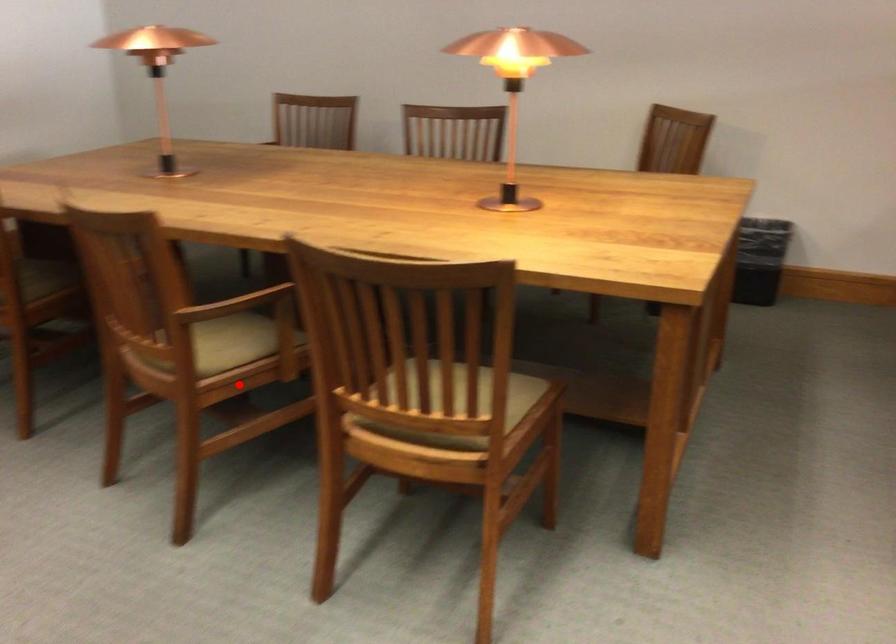
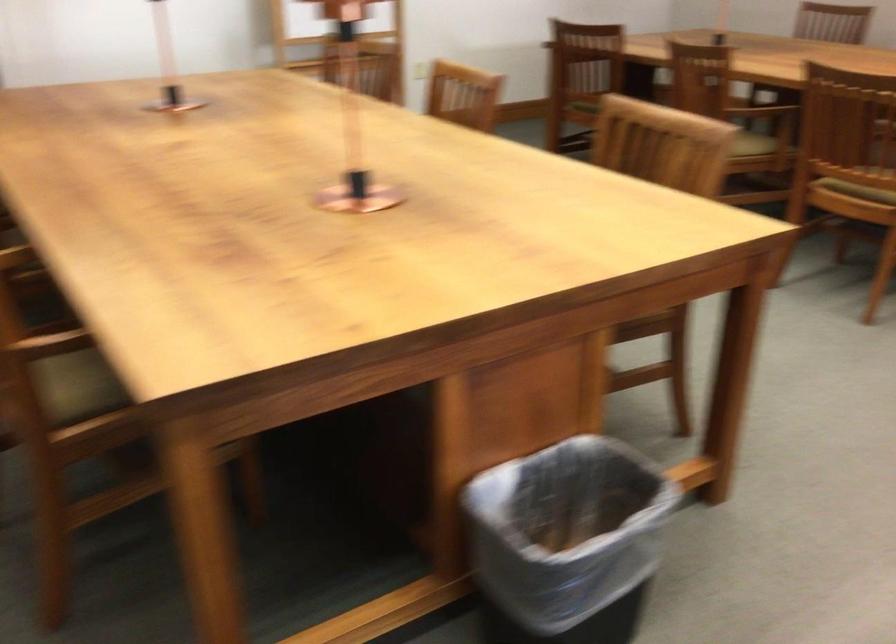
Question: I am providing you with two images of the same scene from different viewpoints. A red point is shown in image1. For the corresponding object point in image2, is it positioned nearer or farther from the camera?

Choices:
 (A) Nearer
 (B) Farther

Answer: (B)